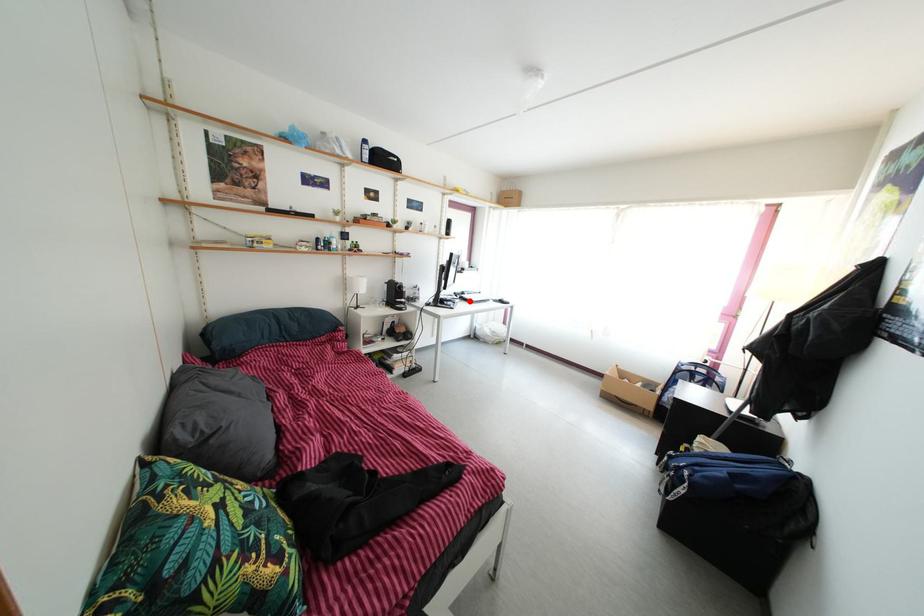
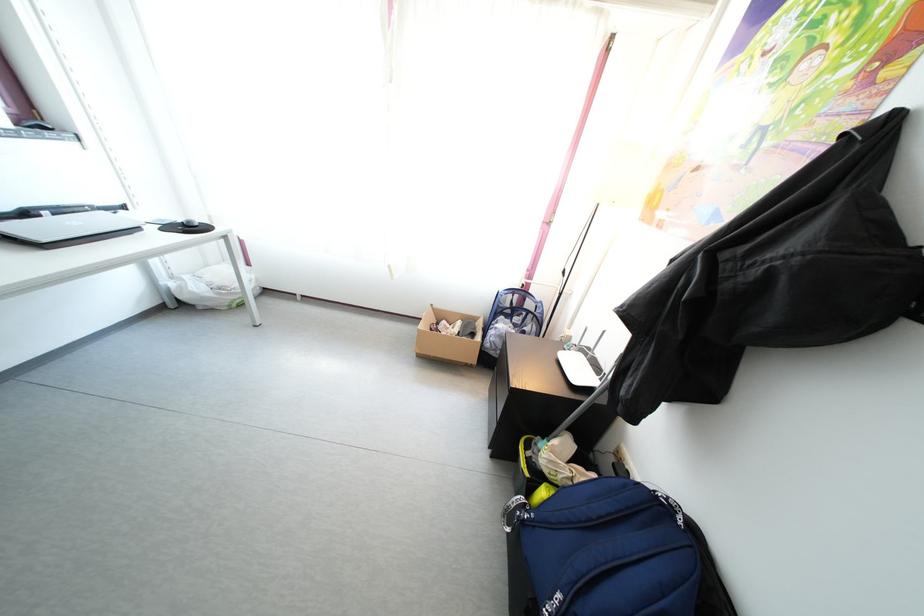
Question: A red point is marked in image1. In image2, is the corresponding 3D point closer to the camera or farther? Reply with the corresponding letter.

Choices:
 (A) The corresponding 3D point is closer.
 (B) The corresponding 3D point is farther.

Answer: (B)